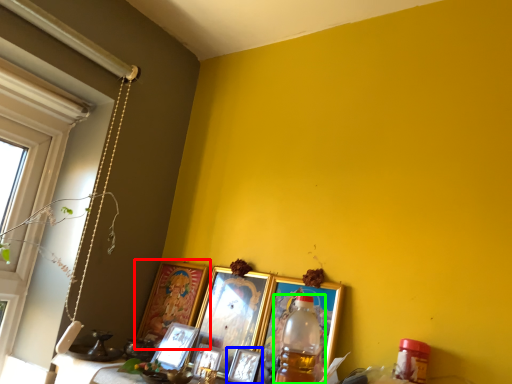
Question: Considering the real-world distances, which object is closest to picture frame (highlighted by a red box)? picture frame (highlighted by a blue box) or bottle (highlighted by a green box).

Choices:
 (A) picture frame
 (B) bottle

Answer: (A)